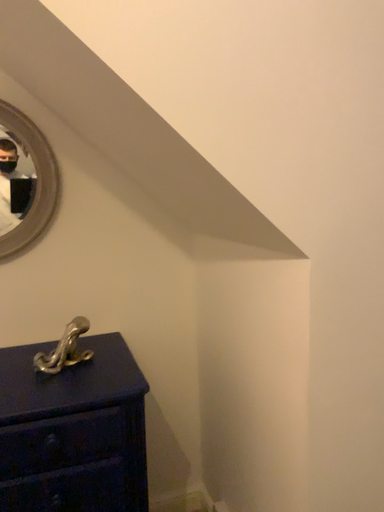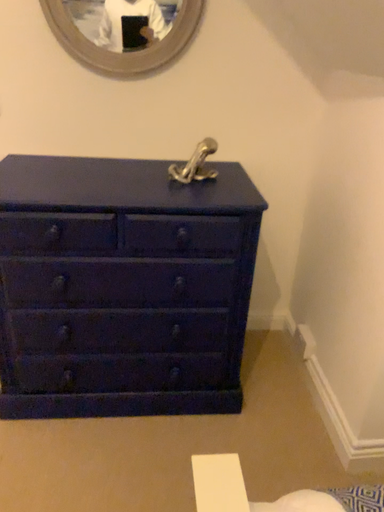
Question: How did the camera likely rotate when shooting the video?

Choices:
 (A) rotated right
 (B) rotated left

Answer: (B)